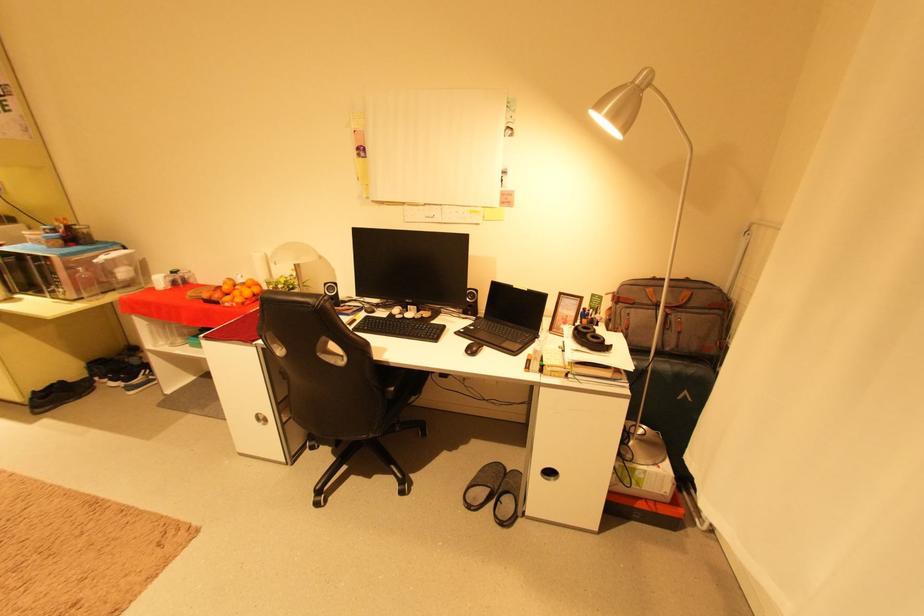
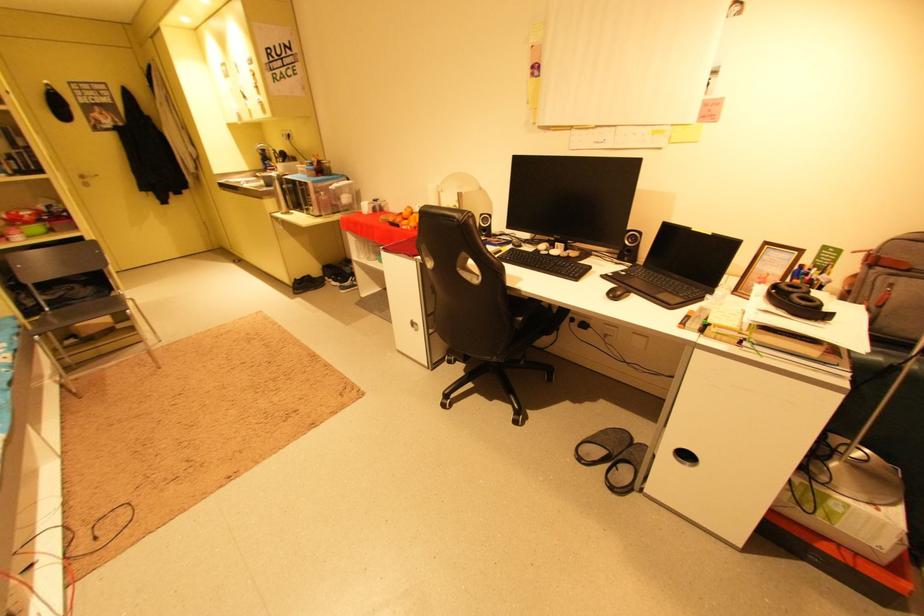
Where in the second image is the point corresponding to the point at 482,350 from the first image?

(627, 294)